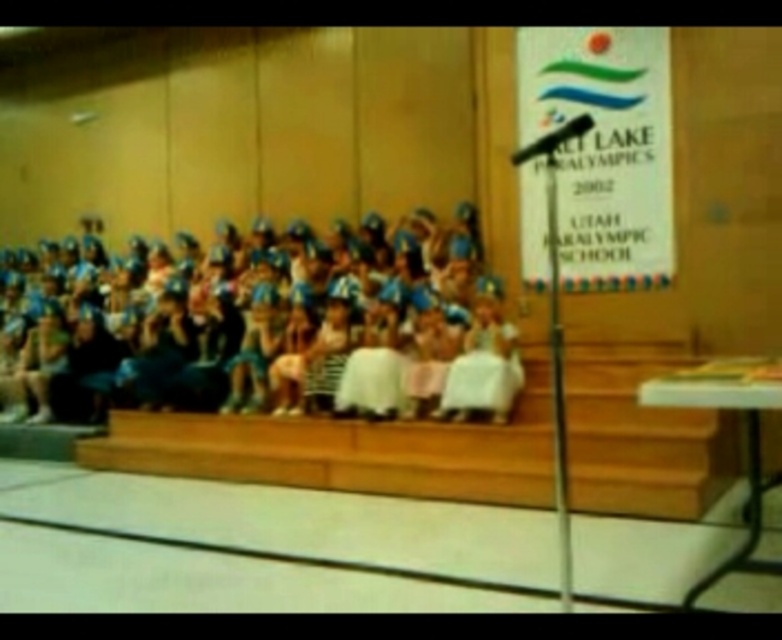
You are an event organizer at the Salt Lake Paralympics 2002. You need to ensure that the blue fabric dress at center and the wooden stairs at center are visible to all attendees. Given their sizes, which object should be placed higher to ensure visibility?

The blue fabric dress at center is bigger than the wooden stairs at center, so placing the blue fabric dress at center higher would ensure better visibility since larger objects are typically placed higher for visibility.